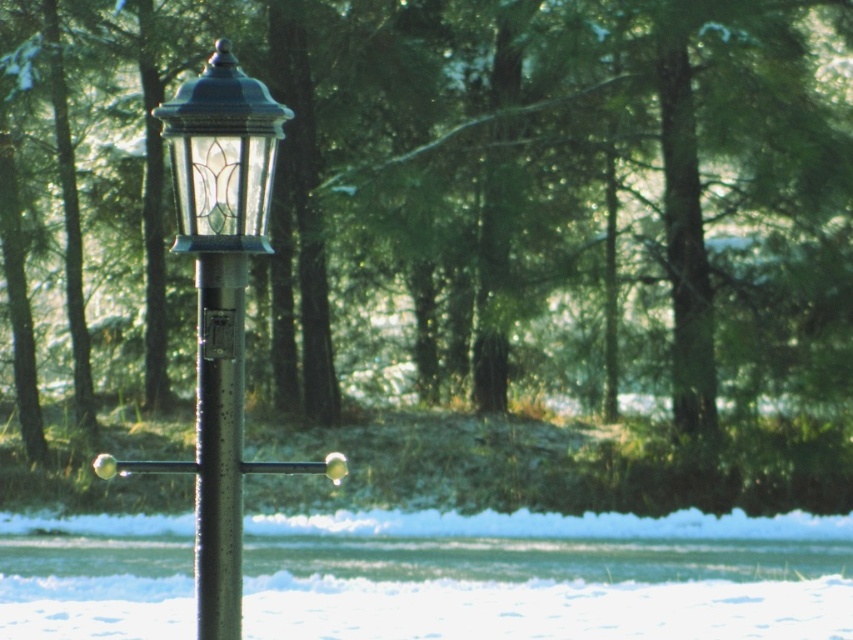
Who is lower down, matte glass lantern at center or metallic pole at center?

metallic pole at center is below.

Is point (171, 173) farther from camera compared to point (199, 429)?

Yes, it is behind point (199, 429).

The image size is (853, 640). What do you see at coordinates (222, 156) in the screenshot? I see `matte glass lantern at center` at bounding box center [222, 156].

Where is `matte glass lantern at center`? The height and width of the screenshot is (640, 853). matte glass lantern at center is located at coordinates (222, 156).

Is glossy metal street light at center to the left of metallic pole at center from the viewer's perspective?

No, glossy metal street light at center is not to the left of metallic pole at center.

Does point (239, 74) come in front of point (213, 563)?

That is True.

This screenshot has height=640, width=853. I want to click on glossy metal street light at center, so click(221, 301).

Consider the image. Can you confirm if glossy metal street light at center is shorter than matte glass lantern at center?

In fact, glossy metal street light at center may be taller than matte glass lantern at center.

Which is behind, point (222, 566) or point (256, 182)?

Positioned behind is point (222, 566).

The image size is (853, 640). I want to click on glossy metal street light at center, so click(221, 301).